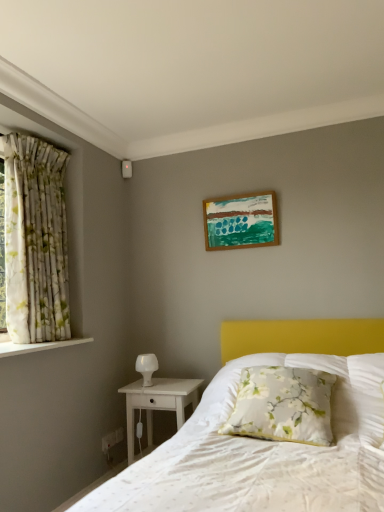
Where is `free space above floral fabric curtain at left (from a real-world perspective)`? This screenshot has width=384, height=512. free space above floral fabric curtain at left (from a real-world perspective) is located at coordinates (41, 138).